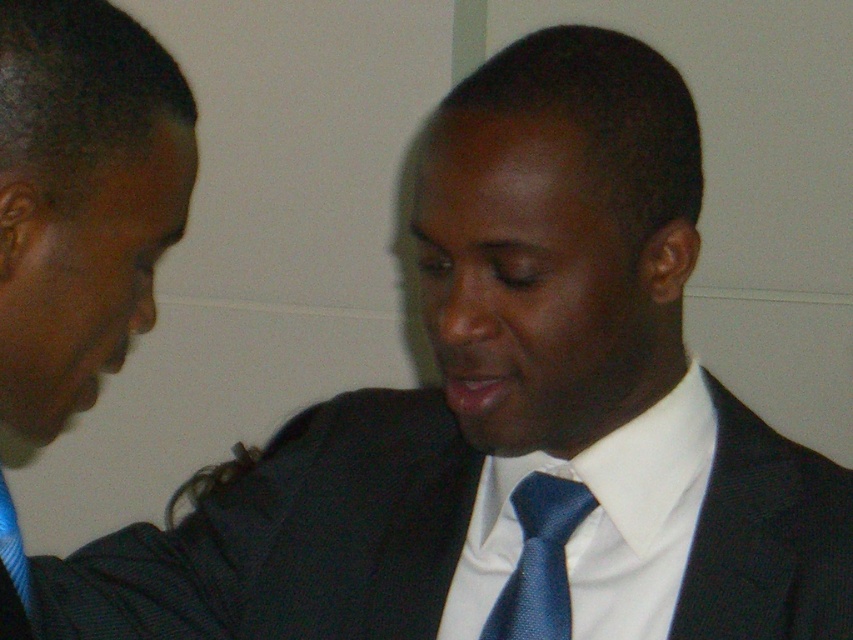
You are a photographer adjusting the focus on a camera. The camera has a focus point at coordinates 0.842, 0.341. Which object in the scene should you focus on to capture the matte black suit at center clearly?

The matte black suit at center is located at point (289, 538), so you should focus on the matte black suit at center to capture it clearly.

You are a photographer who needs to place a microphone stand at the center of the image. The scene has a matte black suit at center. Is the point at coordinates point (x=289, y=538) the correct location for the microphone stand?

Yes, the point at coordinates point (x=289, y=538) is the correct location for the microphone stand because it indicates the matte black suit at center.

In the professional setting depicted, there is a matte black suit at left and a blue textured tie at center. Which object is positioned further to the left?

The matte black suit at left is positioned further to the left than the blue textured tie at center.